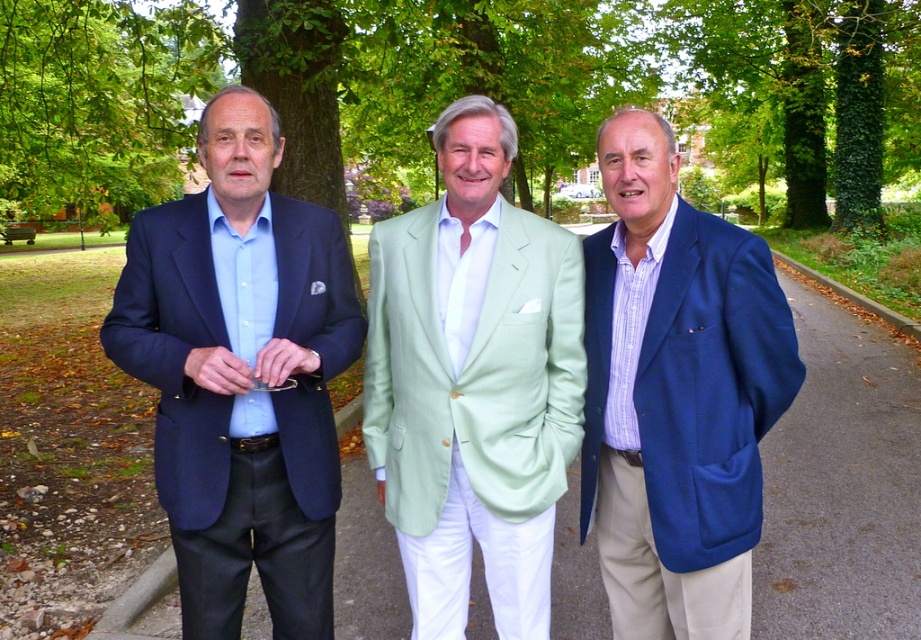
Is green leafy tree at center positioned in front of blue woolen blazer at center?

No, it is not.

What do you see at coordinates (452, 90) in the screenshot?
I see `green leafy tree at center` at bounding box center [452, 90].

You are a GUI agent. You are given a task and a screenshot of the screen. Output one action in this format:
    pyautogui.click(x=<x>, y=<y>)
    Task: Click on the green leafy tree at center
    
    Given the screenshot: What is the action you would take?
    pyautogui.click(x=452, y=90)

Can you confirm if matte blue suit at left is positioned above green leafy tree at left?

Actually, matte blue suit at left is below green leafy tree at left.

Who is positioned more to the right, matte blue suit at left or green leafy tree at left?

matte blue suit at left is more to the right.

Is point (325, 372) closer to viewer compared to point (68, 40)?

Yes, point (325, 372) is closer to viewer.

The image size is (921, 640). Find the location of `matte blue suit at left`. matte blue suit at left is located at coordinates (241, 376).

Does green leafy tree at center have a lesser height compared to matte blue suit at left?

In fact, green leafy tree at center may be taller than matte blue suit at left.

Who is more forward, (904, 138) or (278, 212)?

Point (278, 212) is more forward.

Where is `green leafy tree at center`? green leafy tree at center is located at coordinates (452, 90).